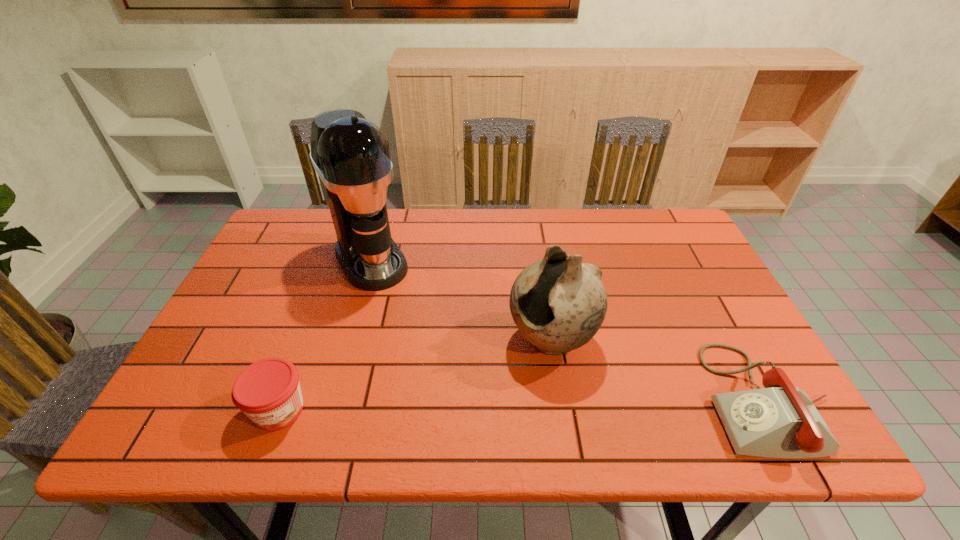
Where is `free location at the left edge`? This screenshot has height=540, width=960. free location at the left edge is located at coordinates (254, 320).

In the image, there is a desktop. Where is `vacant region at the right edge`? Image resolution: width=960 pixels, height=540 pixels. vacant region at the right edge is located at coordinates (701, 283).

You are a GUI agent. You are given a task and a screenshot of the screen. Output one action in this format:
    pyautogui.click(x=<x>, y=<y>)
    Task: Click on the vacant space at the far left corner
    The height and width of the screenshot is (540, 960).
    Given the screenshot: What is the action you would take?
    315,225

At what (x,y) coordinates should I click in order to perform the action: click on vacant space that's between the jam and the pottery. Please return your answer as a coordinate pair (x, y). The image size is (960, 540). Looking at the image, I should click on (416, 375).

Locate an element on the screen. The height and width of the screenshot is (540, 960). vacant point located between the jam and the rightmost object is located at coordinates (523, 404).

Where is `free space between the pottery and the coffee maker`? This screenshot has width=960, height=540. free space between the pottery and the coffee maker is located at coordinates (462, 300).

Locate an element on the screen. The width and height of the screenshot is (960, 540). vacant area between the farthest object and the third shortest object is located at coordinates (462, 300).

Locate an element on the screen. The image size is (960, 540). free space between the second tallest object and the rightmost object is located at coordinates (660, 370).

Where is `free area in between the jam and the tallest object`? free area in between the jam and the tallest object is located at coordinates (325, 335).

Identify the location of free area in between the rightmost object and the jam. The height and width of the screenshot is (540, 960). (523, 404).